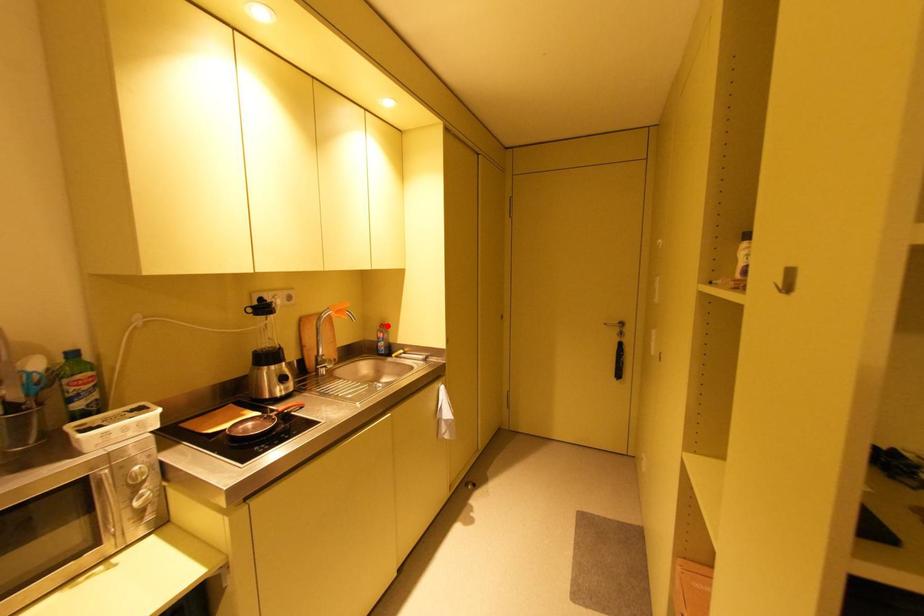
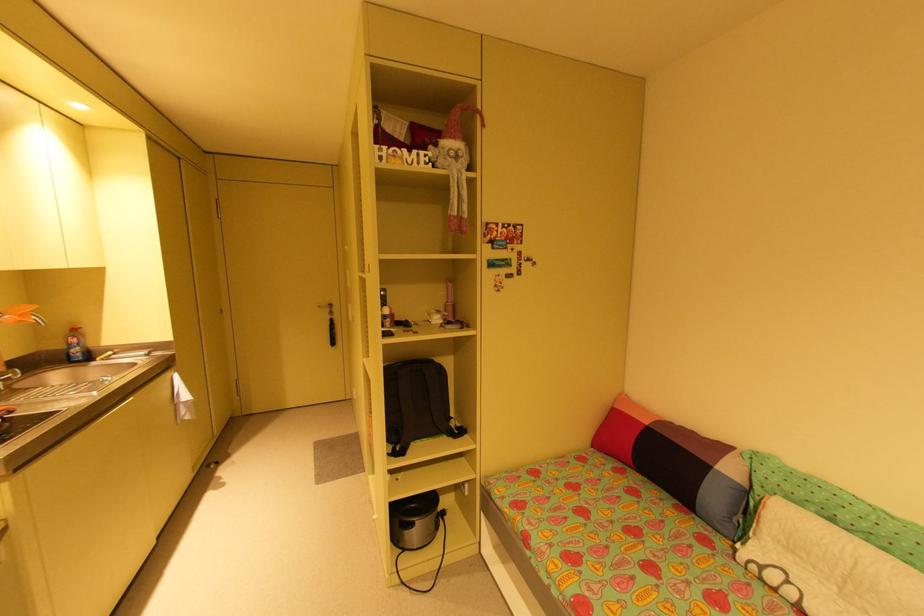
Find the pixel in the second image that matches the highlighted location in the first image.

(79, 331)